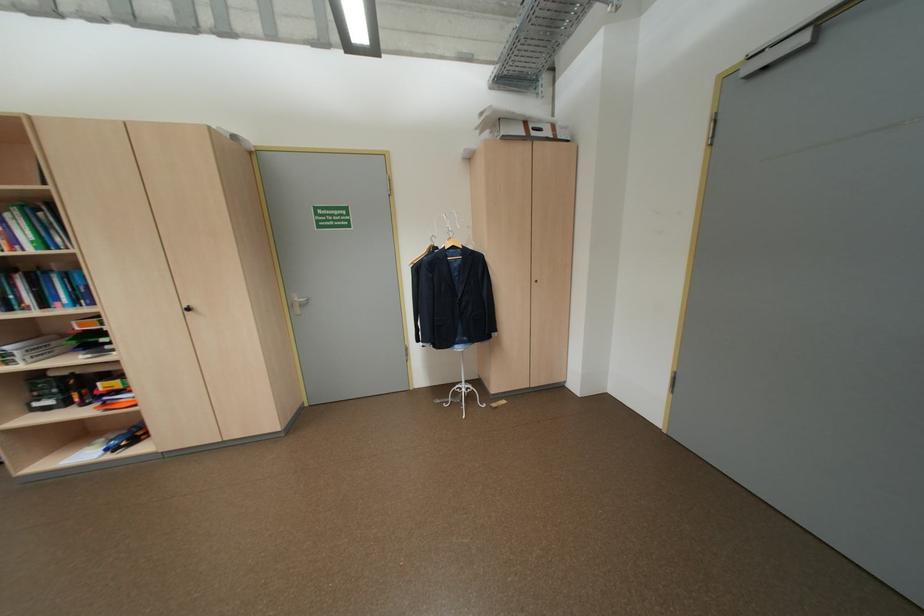
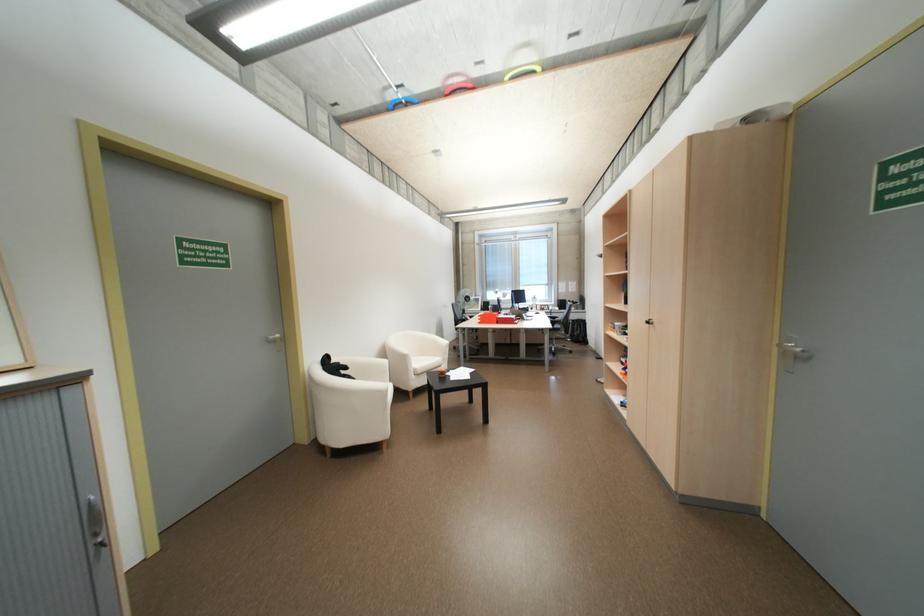
The point at (300, 305) is marked in the first image. Where is the corresponding point in the second image?

(795, 353)